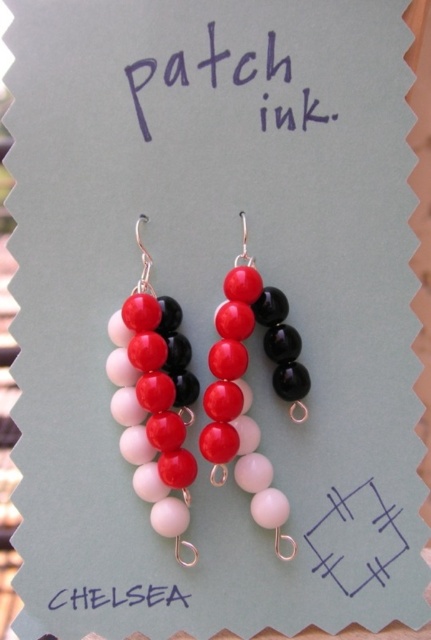
You are holding a ruler and want to measure the distance between the shiny glass beads at center and yourself. If you can only measure up to 1 meter, will your ruler be sufficient?

The distance between the shiny glass beads at center and the viewer is 1.11 meters, so the ruler that can only measure up to 1 meter is not sufficient to measure the full distance.

What is the 2D coordinate of the shiny glass beads at center in the image?

The 2D coordinate of the shiny glass beads at center is at point [240,401].

You are an appraiser examining the earrings. You notice two features on the card next to the earrings. One is the shiny glass beads at center and the other is the blue line at center. Which one is positioned more to the left?

The shiny glass beads at center are to the left of the blue line at center.